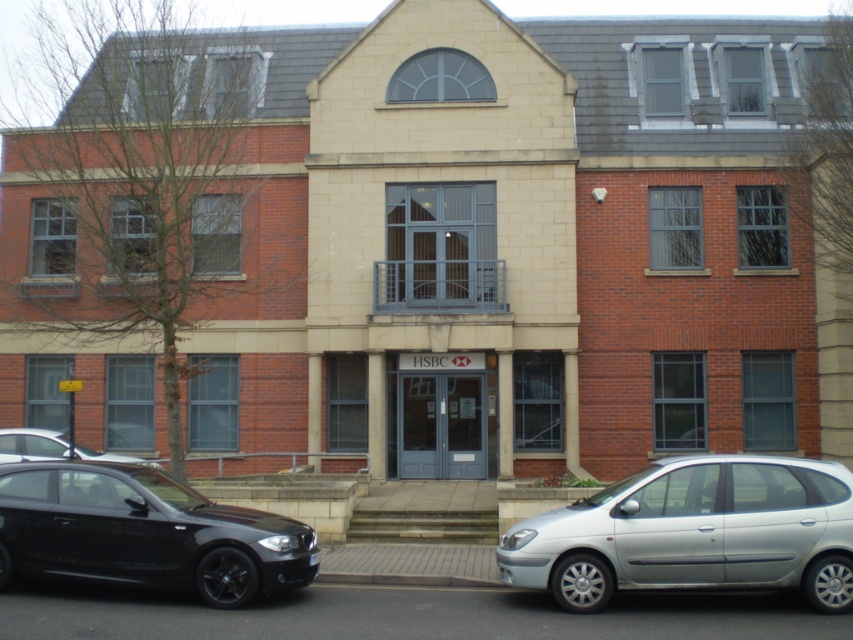
Question: Is shiny black car at lower left below shiny black sedan at lower left?

Choices:
 (A) yes
 (B) no

Answer: (B)

Question: Based on their relative distances, which object is nearer to the silver metallic hatchback at lower right?

Choices:
 (A) shiny black sedan at lower left
 (B) shiny black car at lower left

Answer: (B)

Question: Which object appears farthest from the camera in this image?

Choices:
 (A) silver metallic hatchback at lower right
 (B) shiny black sedan at lower left
 (C) shiny black car at lower left

Answer: (B)

Question: Is shiny black car at lower left thinner than shiny black sedan at lower left?

Choices:
 (A) yes
 (B) no

Answer: (B)

Question: Which object appears farthest from the camera in this image?

Choices:
 (A) shiny black sedan at lower left
 (B) shiny black car at lower left

Answer: (A)

Question: In this image, where is silver metallic hatchback at lower right located relative to shiny black car at lower left?

Choices:
 (A) above
 (B) below

Answer: (A)